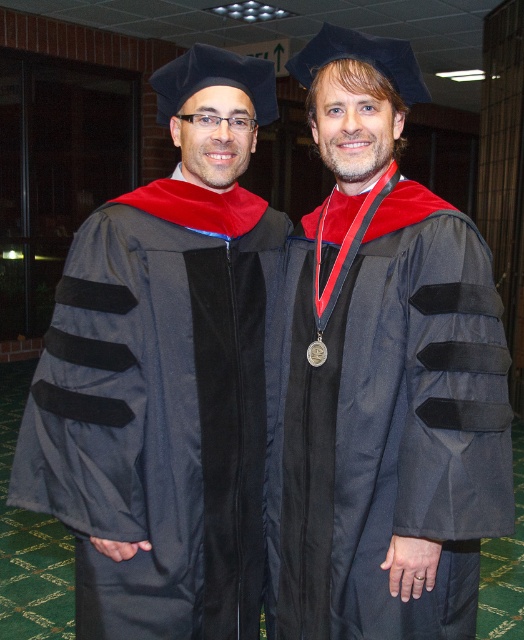
You are an event photographer at a graduation ceremony. You need to capture a photo of both the matte black graduation gown at center and the velvet black graduation gown at left. Given that your camera can only focus on one gown at a time, which gown should you focus on to ensure the subject appears larger in the photo?

The matte black graduation gown at center should be focused on because it is larger in size than the velvet black graduation gown at left, ensuring it will appear bigger in the photo.